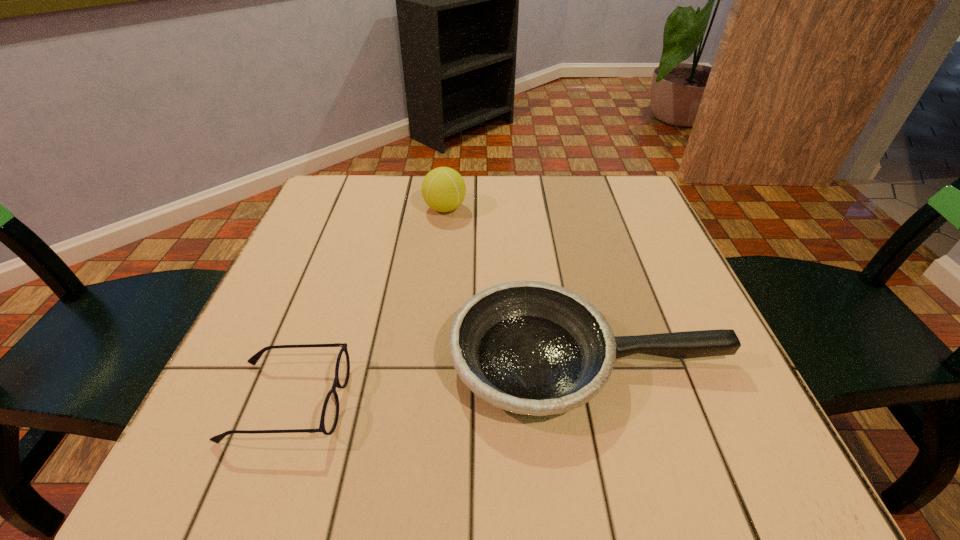
Locate an element on the screen. the tallest object is located at coordinates (443, 189).

Identify the location of tennis ball. This screenshot has width=960, height=540. 443,189.

Locate an element on the screen. frying pan is located at coordinates (533, 348).

This screenshot has height=540, width=960. I want to click on spectacles, so click(x=330, y=412).

This screenshot has height=540, width=960. I want to click on vacant region located 0.190m on the front of the farthest object, so click(438, 273).

Identify the location of free spot located 0.150m on the front-facing side of the spectacles. (439, 401).

This screenshot has width=960, height=540. I want to click on object located at the far edge, so click(443, 189).

This screenshot has width=960, height=540. What are the coordinates of `frying pan positioned at the near edge` in the screenshot? It's located at (533, 348).

Where is `spectacles that is at the near edge`? Image resolution: width=960 pixels, height=540 pixels. spectacles that is at the near edge is located at coordinates (330, 412).

Locate an element on the screen. object at the left edge is located at coordinates (330, 412).